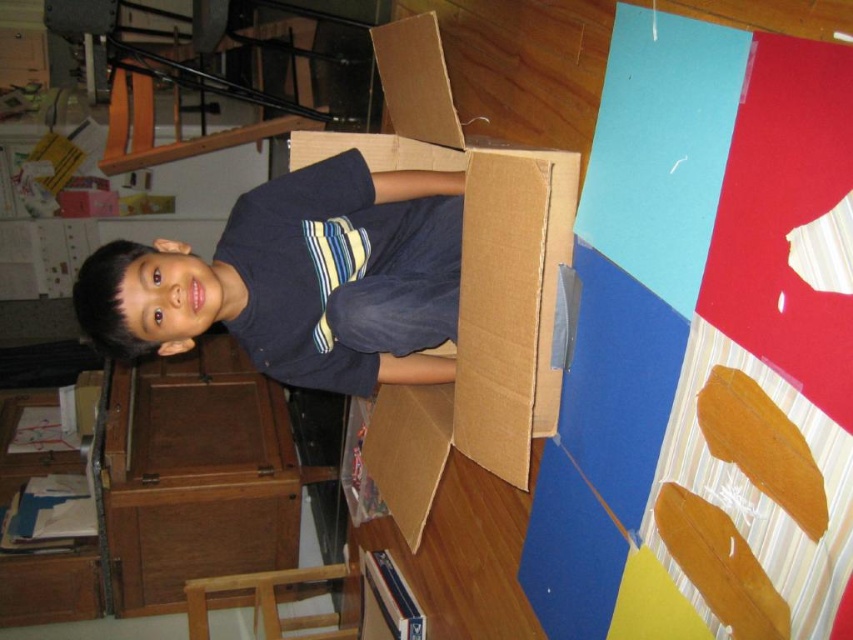
Between dark blue shirt at center and cardboard box at center, which one is positioned lower?

Positioned lower is cardboard box at center.

Which is in front, point (357, 275) or point (407, 408)?

Point (357, 275) is in front.

Find the location of a particular element. dark blue shirt at center is located at coordinates (297, 276).